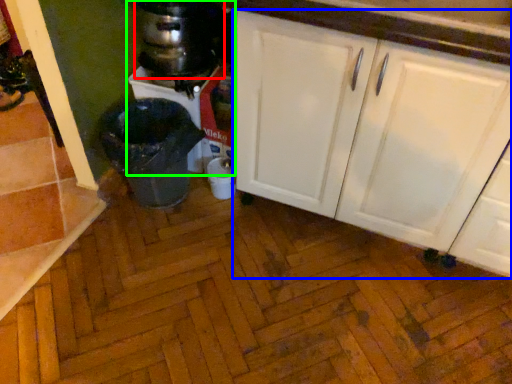
Question: Which object is positioned farthest from appliance (highlighted by a red box)? Select from cabinetry (highlighted by a blue box) and blender (highlighted by a green box).

Choices:
 (A) cabinetry
 (B) blender

Answer: (A)